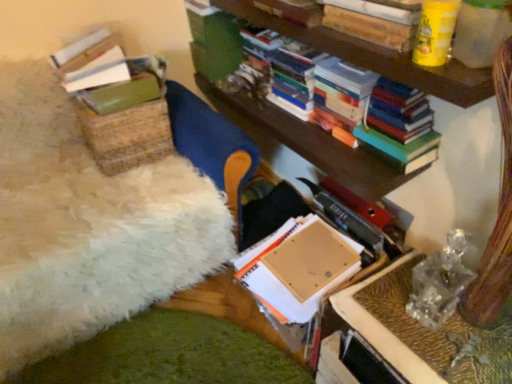
The height and width of the screenshot is (384, 512). Find the location of `free space above translucent plastic table at lower right (from a real-world perspective)`. free space above translucent plastic table at lower right (from a real-world perspective) is located at coordinates (450, 322).